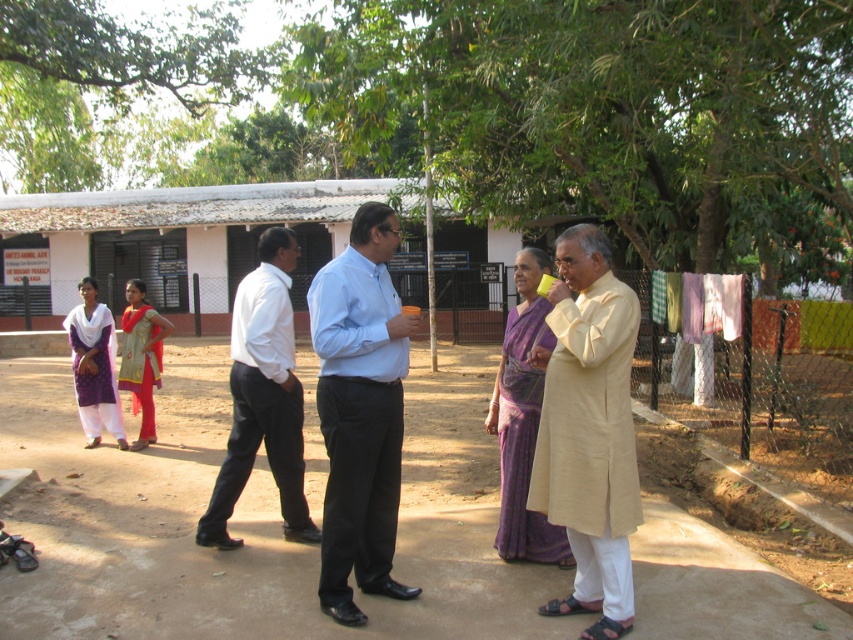
Question: Which point appears closest to the camera in this image?

Choices:
 (A) (519, 554)
 (B) (3, 3)
 (C) (396, 310)
 (D) (109, 390)

Answer: (C)

Question: Does beige cotton kurta at center appear over light blue shirt at center?

Choices:
 (A) no
 (B) yes

Answer: (A)

Question: Can you confirm if white cotton shirt at center is bigger than matte gold dress at center?

Choices:
 (A) no
 (B) yes

Answer: (B)

Question: Among these points, which one is nearest to the camera?

Choices:
 (A) (502, 502)
 (B) (337, 449)

Answer: (B)

Question: Considering the real-world distances, which object is farthest from the white cotton shirt at center?

Choices:
 (A) matte gold dress at center
 (B) beige cotton kurta at center
 (C) purple cotton dress at left
 (D) green leafy tree at upper center

Answer: (D)

Question: Is green leafy tree at upper center bigger than beige cotton kurta at center?

Choices:
 (A) no
 (B) yes

Answer: (B)